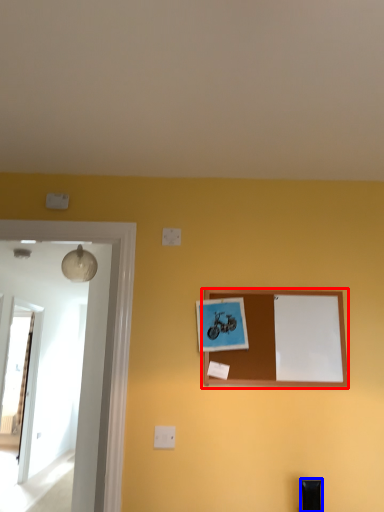
Question: Which of the following is the closest to the observer, picture frame (highlighted by a red box) or furniture (highlighted by a blue box)?

Choices:
 (A) picture frame
 (B) furniture

Answer: (B)